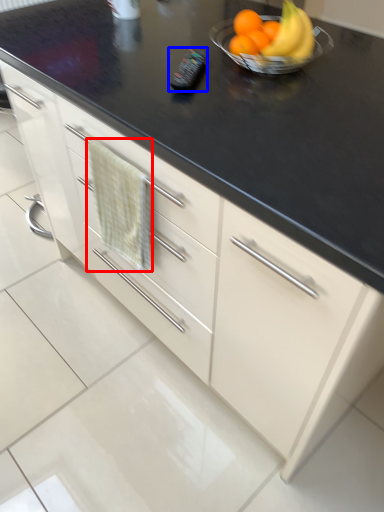
Question: Which point is closer to the camera, hand towel (highlighted by a red box) or appliance (highlighted by a blue box)?

Choices:
 (A) hand towel
 (B) appliance

Answer: (A)